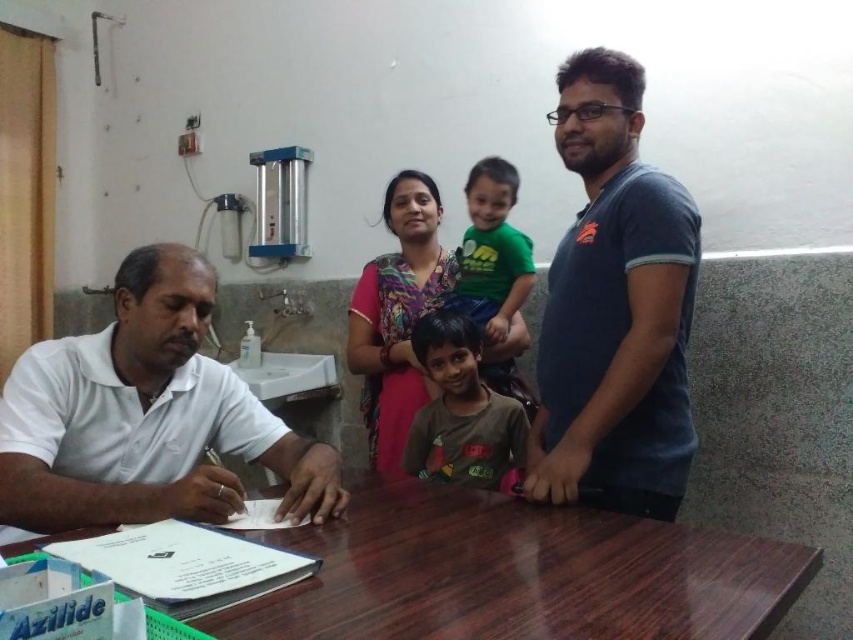
Question: Does multicolored fabric family at center have a smaller size compared to green matte shirt at center?

Choices:
 (A) yes
 (B) no

Answer: (B)

Question: Is white matte shirt at left positioned before multicolored fabric family at center?

Choices:
 (A) no
 (B) yes

Answer: (B)

Question: Estimate the real-world distances between objects in this image. Which object is closer to the green matte shirt at center?

Choices:
 (A) brown glossy table at center
 (B) blue cotton t-shirt at right

Answer: (B)

Question: Which of the following is the closest to the observer?

Choices:
 (A) (363, 342)
 (B) (466, 360)
 (C) (566, 65)

Answer: (C)

Question: Which point is farther to the camera?

Choices:
 (A) (409, 365)
 (B) (686, 227)
 (C) (13, 460)
 (D) (793, 584)

Answer: (A)

Question: Does brown glossy table at center appear under multicolored fabric family at center?

Choices:
 (A) yes
 (B) no

Answer: (A)